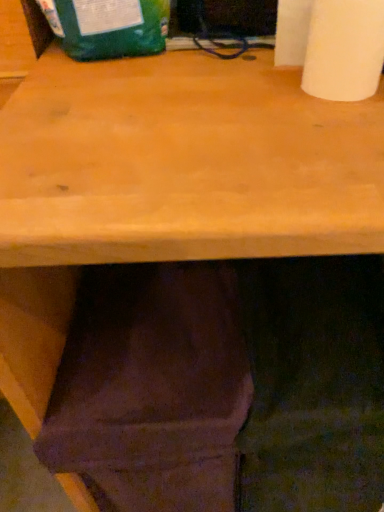
Where is `white paper at upper right`? white paper at upper right is located at coordinates (344, 49).

The width and height of the screenshot is (384, 512). Describe the element at coordinates (344, 49) in the screenshot. I see `white paper at upper right` at that location.

This screenshot has height=512, width=384. What are the coordinates of `white paper at upper right` in the screenshot? It's located at (344, 49).